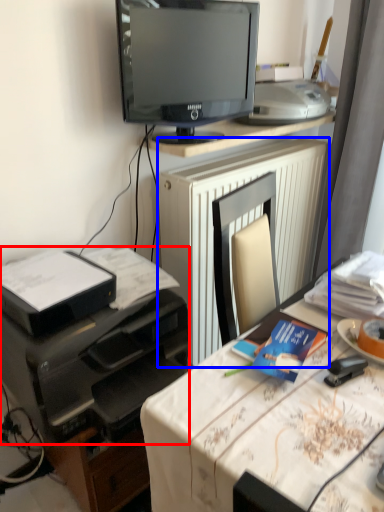
Question: Which point is further to the camera, printer (highlighted by a red box) or radiator (highlighted by a blue box)?

Choices:
 (A) printer
 (B) radiator

Answer: (B)